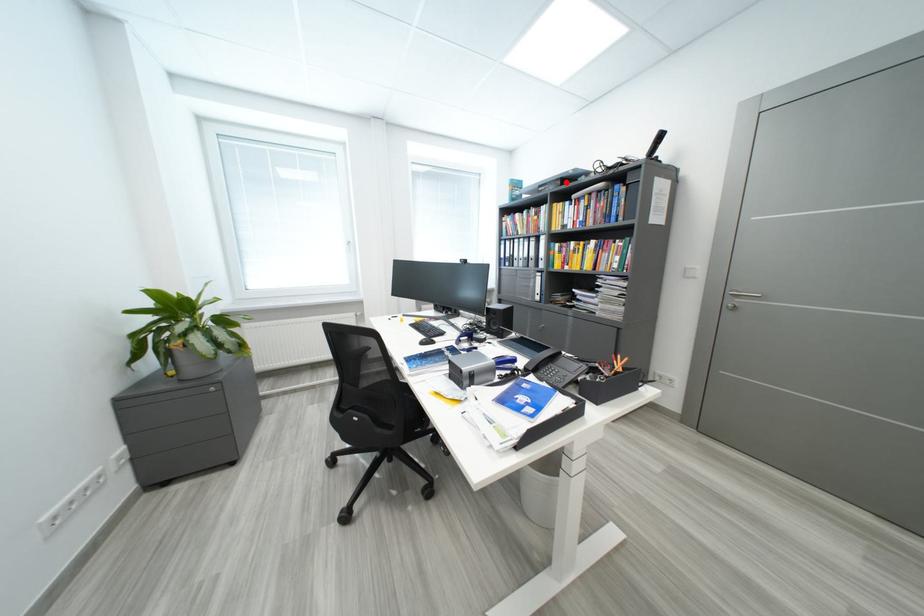
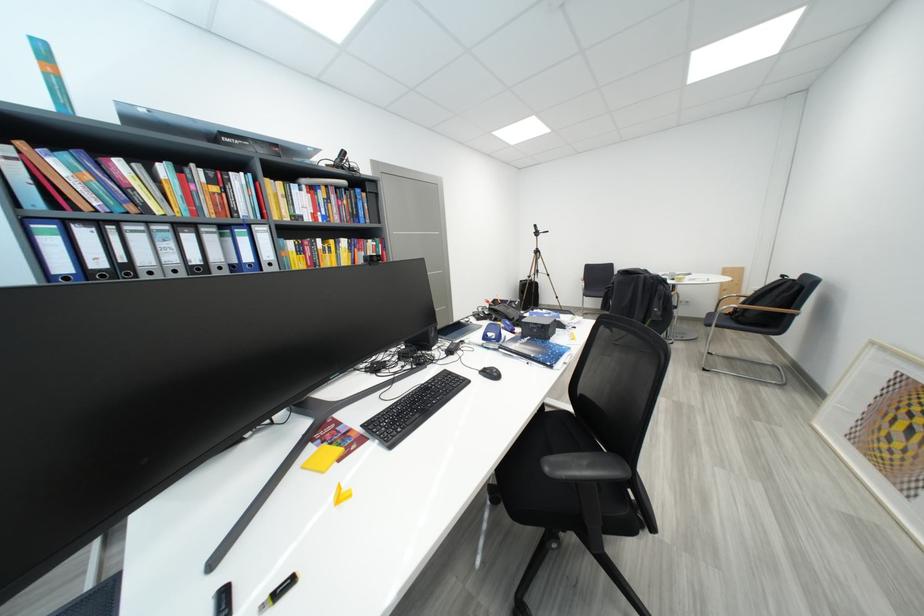
Find the pixel in the second image that matches the highlighted location in the first image.

(286, 148)